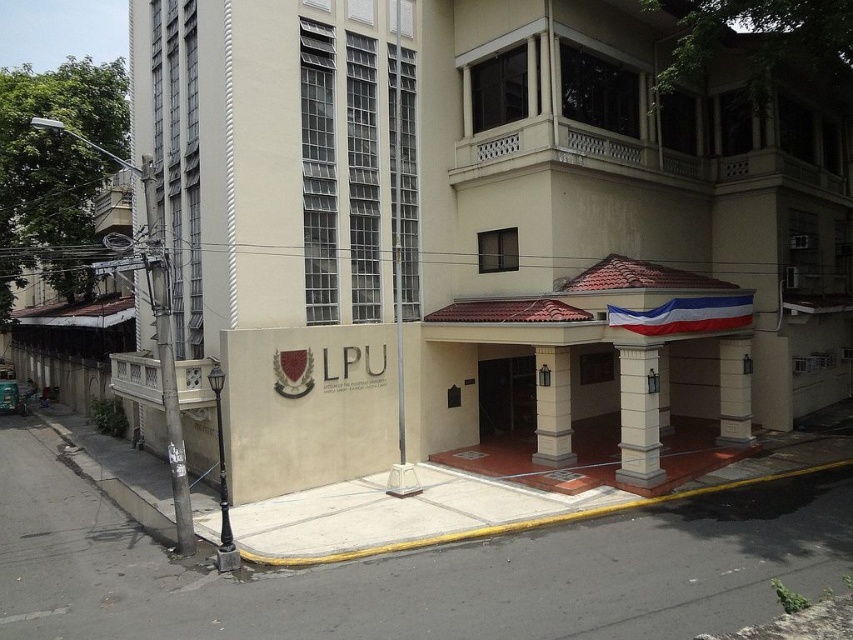
Question: Among these objects, which one is nearest to the camera?

Choices:
 (A) beige concrete building at center
 (B) white fabric flag at center

Answer: (B)

Question: Is beige concrete building at center wider than white fabric flag at center?

Choices:
 (A) yes
 (B) no

Answer: (A)

Question: Can you confirm if beige concrete building at center is wider than white fabric flag at center?

Choices:
 (A) yes
 (B) no

Answer: (A)

Question: From the image, what is the correct spatial relationship of beige concrete building at center in relation to white fabric flag at center?

Choices:
 (A) left
 (B) right

Answer: (A)

Question: Among these points, which one is farthest from the camera?

Choices:
 (A) (160, 67)
 (B) (741, 310)

Answer: (A)